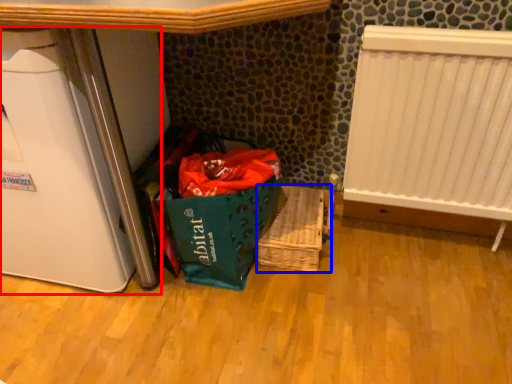
Question: Which of the following is the closest to the observer, appliance (highlighted by a red box) or basket (highlighted by a blue box)?

Choices:
 (A) appliance
 (B) basket

Answer: (A)